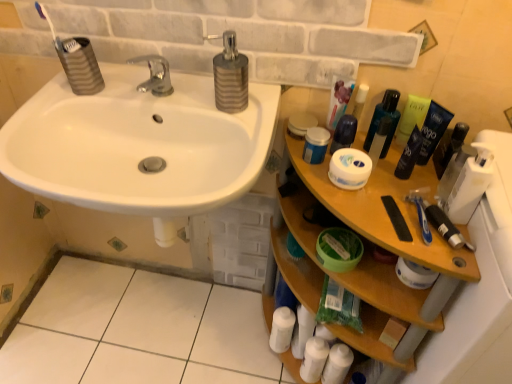
The image size is (512, 384). Find the location of `free location in front of silver metallic soap dispenser at upper center`. free location in front of silver metallic soap dispenser at upper center is located at coordinates (247, 140).